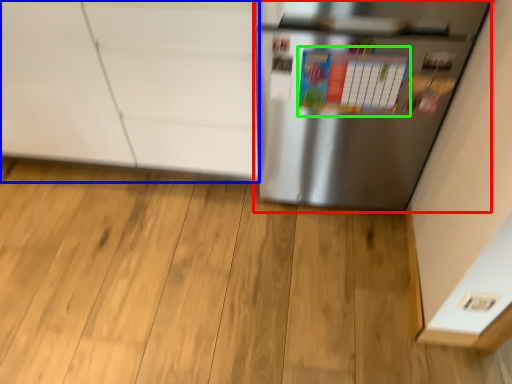
Question: Based on their relative distances, which object is nearer to refrigerator (highlighted by a red box)? Choose from cabinetry (highlighted by a blue box) and bulletin board (highlighted by a green box).

Choices:
 (A) cabinetry
 (B) bulletin board

Answer: (B)